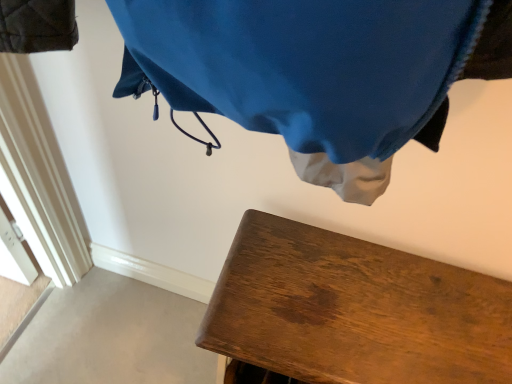
Image resolution: width=512 pixels, height=384 pixels. What do you see at coordinates (351, 312) in the screenshot? I see `wooden bench at lower right` at bounding box center [351, 312].

Where is `wooden bench at lower right`? This screenshot has height=384, width=512. wooden bench at lower right is located at coordinates (351, 312).

Image resolution: width=512 pixels, height=384 pixels. I want to click on wooden bench at lower right, so click(x=351, y=312).